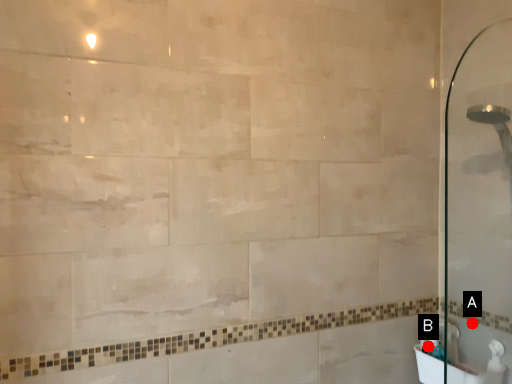
Question: Two points are circled on the image, labeled by A and B beside each circle. Which of the following is the closest to the observer?

Choices:
 (A) A is closer
 (B) B is closer

Answer: (A)